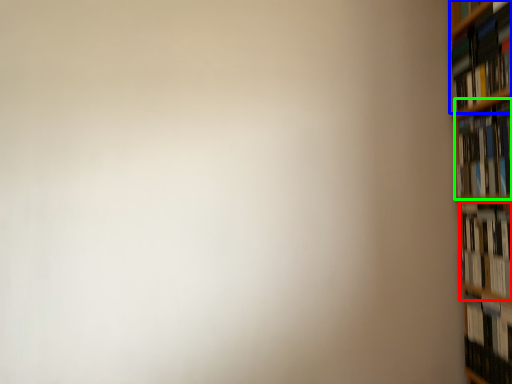
Question: Which is nearer to the book (highlighted by a red box)? book (highlighted by a blue box) or book (highlighted by a green box).

Choices:
 (A) book
 (B) book

Answer: (B)